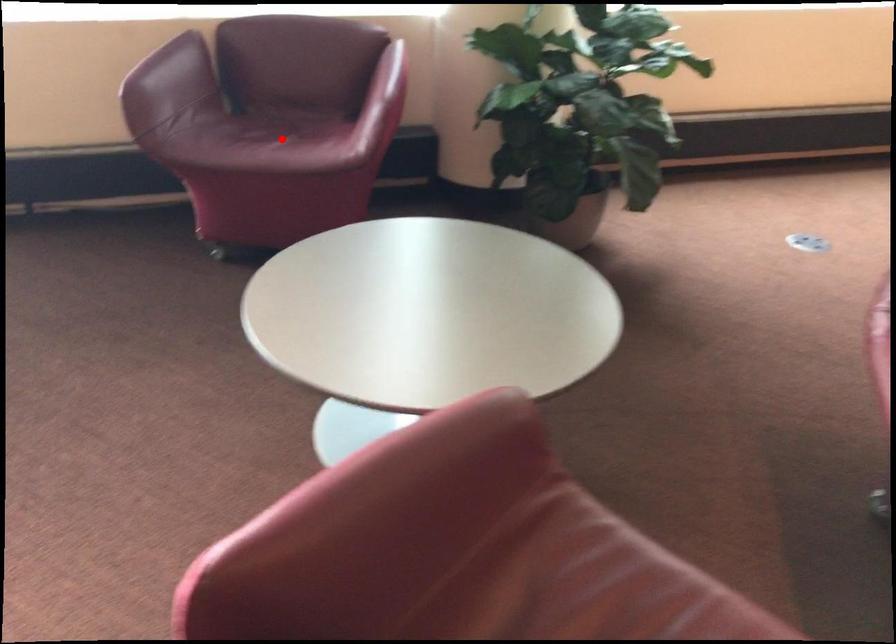
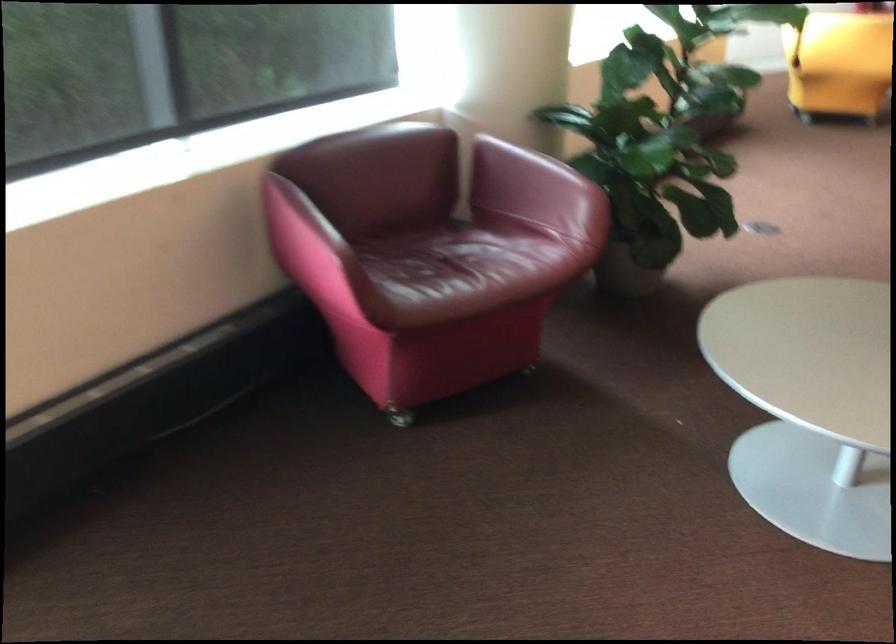
Question: I am providing you with two images of the same scene from different viewpoints. In image1, a red point is highlighted. Considering the same 3D point in image2, which of the following is correct?

Choices:
 (A) It is closer
 (B) It is farther

Answer: (A)